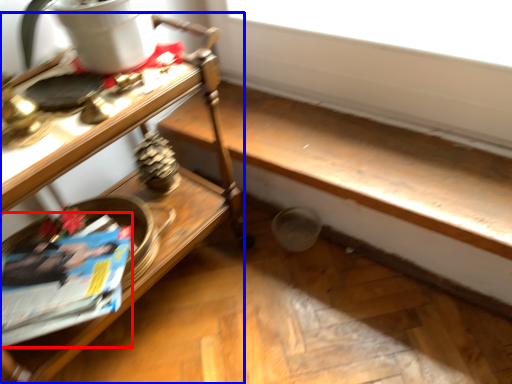
Question: Which object is further to the camera taking this photo, magazine (highlighted by a red box) or table (highlighted by a blue box)?

Choices:
 (A) magazine
 (B) table

Answer: (A)